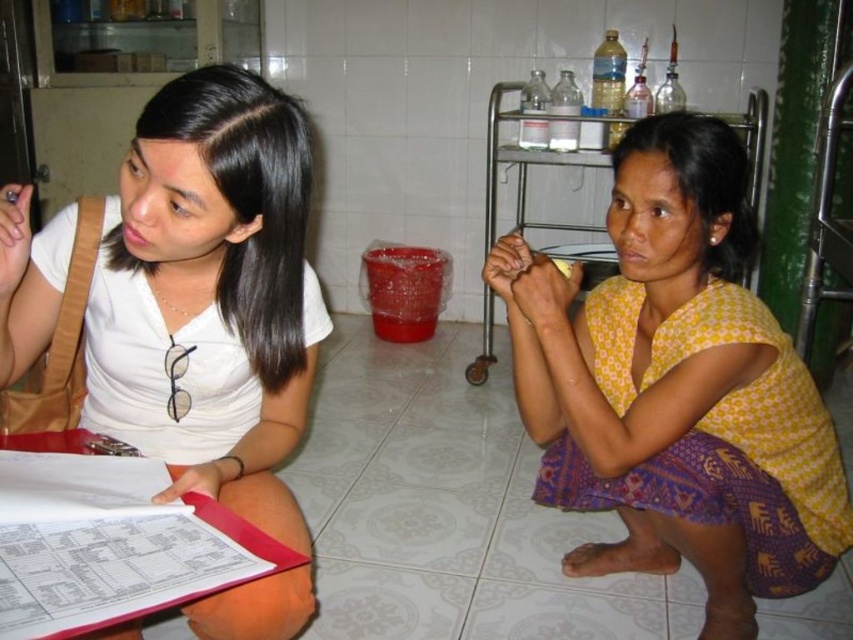
Can you confirm if white matte shirt at upper left is taller than pink plastic clipboard at lower left?

Correct, white matte shirt at upper left is much taller as pink plastic clipboard at lower left.

Is white matte shirt at upper left positioned behind pink plastic clipboard at lower left?

That is True.

The width and height of the screenshot is (853, 640). What are the coordinates of `white matte shirt at upper left` in the screenshot? It's located at (180, 296).

You are a GUI agent. You are given a task and a screenshot of the screen. Output one action in this format:
    pyautogui.click(x=<x>, y=<y>)
    Task: Click on the white matte shirt at upper left
    
    Given the screenshot: What is the action you would take?
    tap(180, 296)

Does point (659, 115) come closer to viewer compared to point (35, 628)?

No.

Does point (695, 150) come farther from viewer compared to point (84, 605)?

Yes, point (695, 150) is farther from viewer.

Does point (756, 396) come closer to viewer compared to point (200, 532)?

No, it is behind (200, 532).

At what (x,y) coordinates should I click in order to perform the action: click on yellow printed fabric skirt at lower right. Please return your answer as a coordinate pair (x, y). The height and width of the screenshot is (640, 853). Looking at the image, I should click on (677, 387).

Does yellow printed fabric skirt at lower right have a lesser width compared to white matte shirt at upper left?

In fact, yellow printed fabric skirt at lower right might be wider than white matte shirt at upper left.

What do you see at coordinates (677, 387) in the screenshot?
I see `yellow printed fabric skirt at lower right` at bounding box center [677, 387].

What are the coordinates of `yellow printed fabric skirt at lower right` in the screenshot? It's located at (677, 387).